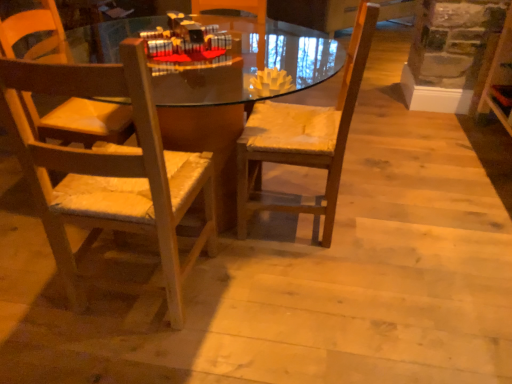
Where is `vacant area that lies to the right of matte wood desk at center`? This screenshot has width=512, height=384. vacant area that lies to the right of matte wood desk at center is located at coordinates (408, 222).